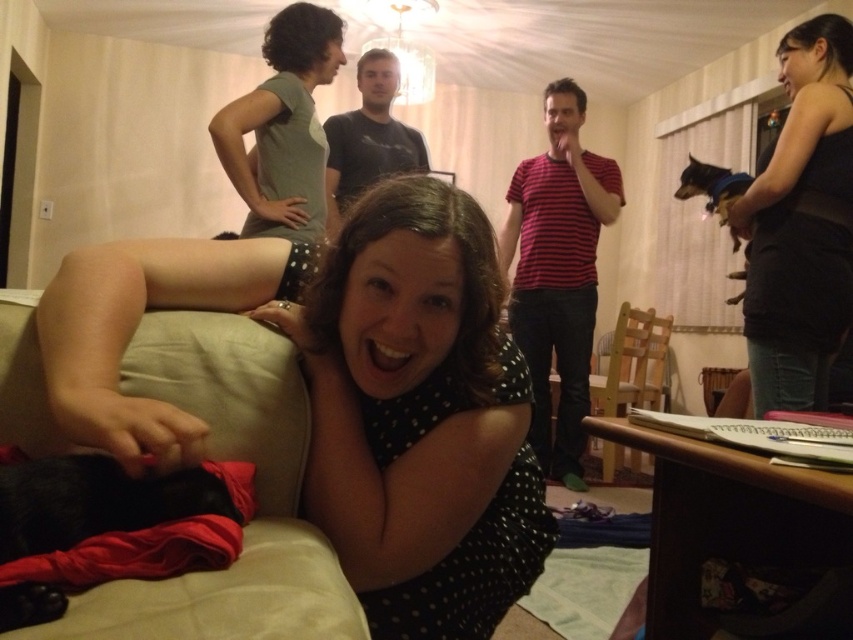
Who is taller, beige fabric couch at lower left or black cotton shirt at center?

With more height is black cotton shirt at center.

Can you confirm if beige fabric couch at lower left is taller than black cotton shirt at center?

In fact, beige fabric couch at lower left may be shorter than black cotton shirt at center.

Which is behind, point (210, 433) or point (386, 76)?

The point (386, 76) is more distant.

Image resolution: width=853 pixels, height=640 pixels. Find the location of `beige fabric couch at lower left`. beige fabric couch at lower left is located at coordinates (254, 497).

Measure the distance between beige fabric couch at lower left and camera.

They are 23.24 inches apart.

The width and height of the screenshot is (853, 640). Describe the element at coordinates (254, 497) in the screenshot. I see `beige fabric couch at lower left` at that location.

The width and height of the screenshot is (853, 640). What do you see at coordinates (254, 497) in the screenshot?
I see `beige fabric couch at lower left` at bounding box center [254, 497].

Where is `beige fabric couch at lower left`? The width and height of the screenshot is (853, 640). beige fabric couch at lower left is located at coordinates [254, 497].

Who is taller, black dotted dress at center or black tank top at upper right?

With more height is black tank top at upper right.

Is point (392, 634) less distant than point (827, 230)?

Yes, it is.

The width and height of the screenshot is (853, 640). Describe the element at coordinates (416, 413) in the screenshot. I see `black dotted dress at center` at that location.

Find the location of `black dotted dress at center`. black dotted dress at center is located at coordinates (416, 413).